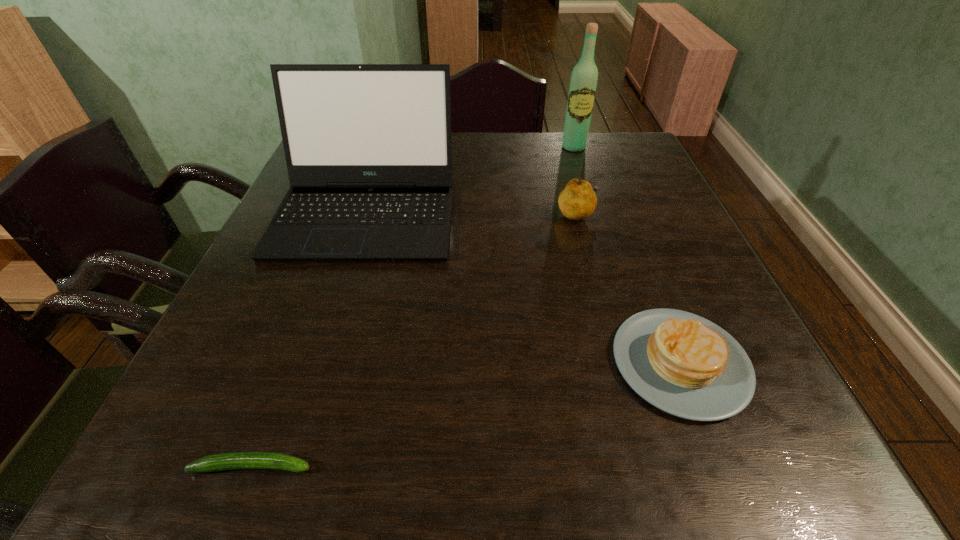
This screenshot has width=960, height=540. I want to click on the farthest object, so click(x=584, y=77).

Where is `laptop`? This screenshot has width=960, height=540. laptop is located at coordinates (368, 148).

Identify the location of pear. (577, 201).

Find the location of a particular element. The image size is (960, 540). pancake is located at coordinates (683, 364).

At what (x,y) coordinates should I click in order to perform the action: click on the second nearest object. Please return your answer as a coordinate pair (x, y). The image size is (960, 540). Looking at the image, I should click on (683, 364).

Identify the location of the shortest object. (238, 460).

Where is `the nearest object`? This screenshot has width=960, height=540. the nearest object is located at coordinates (238, 460).

The height and width of the screenshot is (540, 960). What are the coordinates of `vacant area located on the front-facing side of the wine bottle` in the screenshot? It's located at (592, 205).

Locate an element on the screen. The width and height of the screenshot is (960, 540). free space located on the surface of the second tallest object is located at coordinates (315, 377).

Identify the location of vacant space situated on the left of the third shortest object. This screenshot has height=540, width=960. (452, 214).